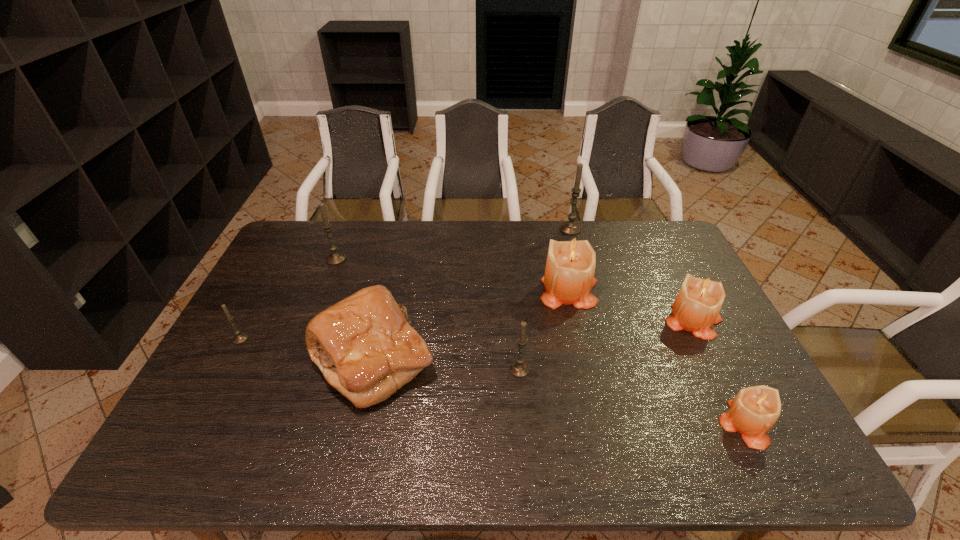
I want to click on vacant area that lies between the nearest gray candle and the brownish-beige bread, so click(x=446, y=364).

Identify the location of vacant space in between the nearest candle and the second nearest gray candle. (492, 381).

Identify the location of empty space that is in between the leftmost beige candle and the nearest candle. (657, 356).

Locate an element on the screen. The width and height of the screenshot is (960, 540). free space between the second smallest beige candle and the farthest candle is located at coordinates (633, 275).

Locate an element on the screen. vacant area that lies between the leftmost beige candle and the second biggest beige candle is located at coordinates (632, 305).

At what (x,y) coordinates should I click in order to perform the action: click on free space between the farthest gray candle and the second nearest gray candle. Please return your answer as a coordinate pair (x, y). Looking at the image, I should click on (405, 284).

Where is `empty location between the brownish-beige bread and the nearest candle`? The height and width of the screenshot is (540, 960). empty location between the brownish-beige bread and the nearest candle is located at coordinates (559, 392).

Identify which object is the closest to the biggest gray candle. Please provide its 2D coordinates. Your answer should be formatted as a tuple, i.e. [(x, y)], where the tuple contains the x and y coordinates of a point satisfying the conditions above.

[(569, 277)]

Find the location of a particular element. This screenshot has width=960, height=540. the closest object to the leftmost gray candle is located at coordinates (364, 346).

Where is `candle that is the fifth closest one to the third gray candle from left to right`? The width and height of the screenshot is (960, 540). candle that is the fifth closest one to the third gray candle from left to right is located at coordinates (334, 258).